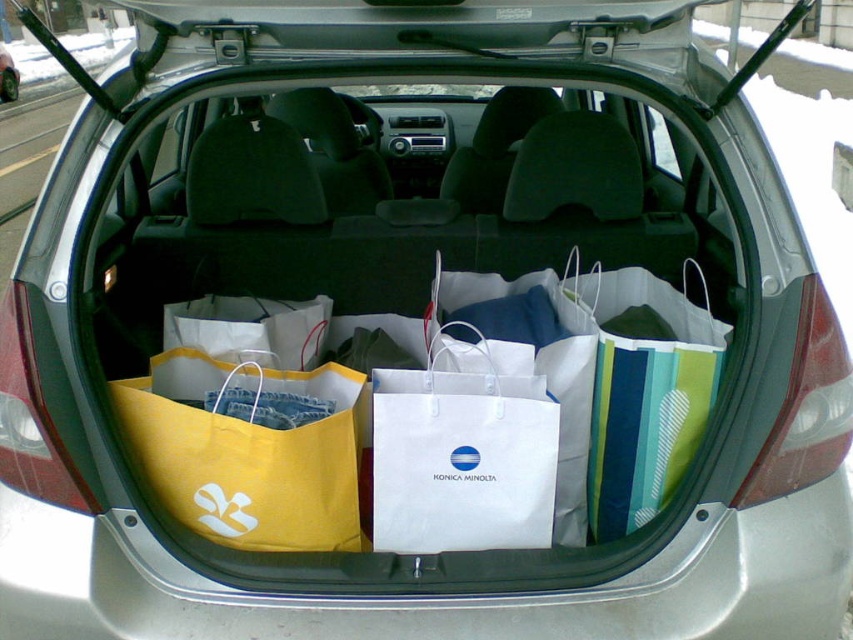
Question: Is yellow paper bag at center below white paper bag at center?

Choices:
 (A) no
 (B) yes

Answer: (B)

Question: Does yellow paper bag at center have a larger size compared to white paper bag at center?

Choices:
 (A) no
 (B) yes

Answer: (A)

Question: Among these points, which one is farthest from the camera?

Choices:
 (A) (482, 528)
 (B) (306, 486)

Answer: (A)

Question: Does yellow paper bag at center have a smaller size compared to white paper bag at center?

Choices:
 (A) yes
 (B) no

Answer: (A)